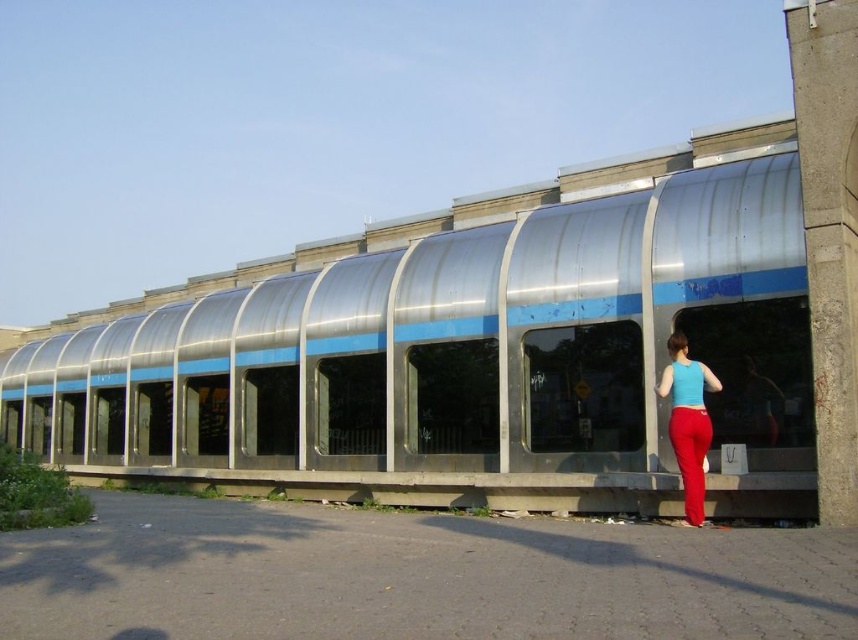
Does metallic silver train at center appear under matte blue tank top at center?

Yes, metallic silver train at center is below matte blue tank top at center.

Between point (340, 305) and point (680, 380), which one is positioned in front?

Point (680, 380)

You are a GUI agent. You are given a task and a screenshot of the screen. Output one action in this format:
    pyautogui.click(x=<x>, y=<y>)
    Task: Click on the metallic silver train at center
    This screenshot has height=640, width=858.
    Given the screenshot: What is the action you would take?
    pyautogui.click(x=467, y=353)